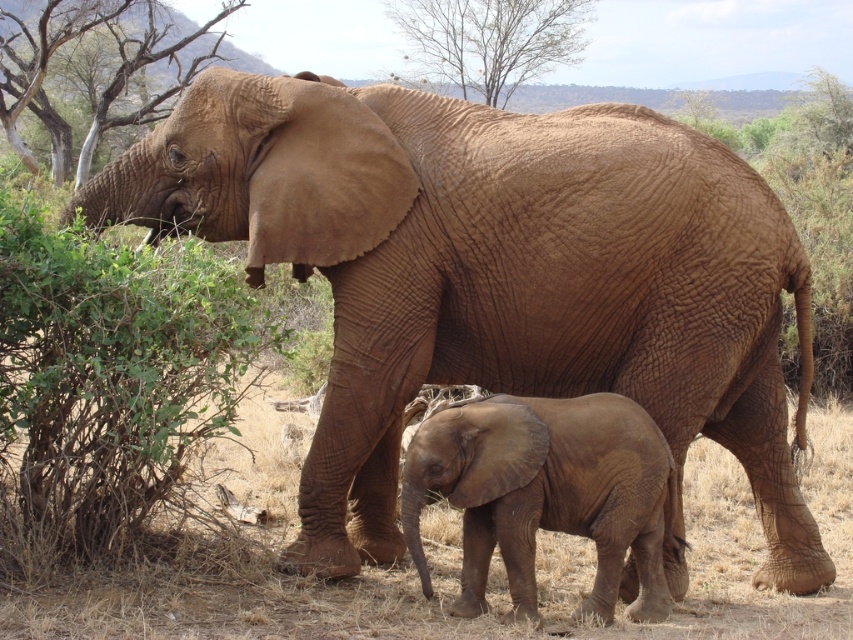
Question: Which object is farther from the camera taking this photo?

Choices:
 (A) green leafy bush at upper left
 (B) bare wood tree at upper center

Answer: (B)

Question: Can you confirm if matte brown elephant at lower center is thinner than bare wood tree at upper center?

Choices:
 (A) yes
 (B) no

Answer: (B)

Question: Considering the real-world distances, which object is farthest from the green leafy bush at upper left?

Choices:
 (A) matte brown elephant at lower center
 (B) brown bark tree at left

Answer: (B)

Question: Observing the image, what is the correct spatial positioning of matte brown elephant at lower center in reference to brown bark tree at left?

Choices:
 (A) below
 (B) above

Answer: (A)

Question: Can you confirm if green leafy bush at upper left is thinner than matte brown elephant at lower center?

Choices:
 (A) no
 (B) yes

Answer: (A)

Question: Which of the following is the closest to the observer?

Choices:
 (A) green leafy bush at upper left
 (B) brown bark tree at left
 (C) bare wood tree at upper center
 (D) matte brown elephant at lower center

Answer: (A)